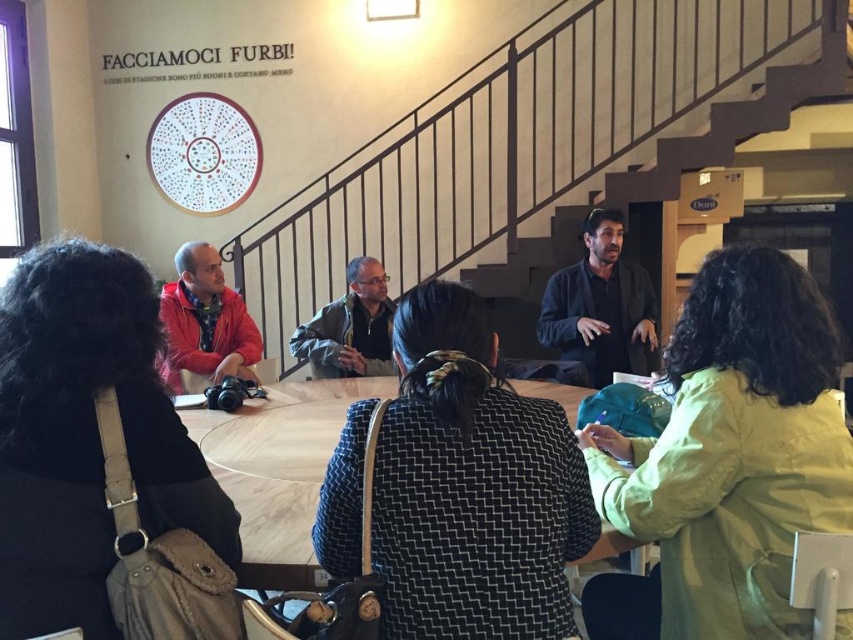
Question: Can you confirm if red jacket at left is positioned to the right of dark blue fabric jacket at center?

Choices:
 (A) yes
 (B) no

Answer: (B)

Question: Which object is closer to the camera taking this photo?

Choices:
 (A) wooden staircase at center
 (B) wooden round table at center

Answer: (B)

Question: Which point is closer to the camera?

Choices:
 (A) (177, 344)
 (B) (262, 516)
 (C) (358, 300)
 (D) (335, 483)

Answer: (D)

Question: Considering the relative positions of green matte jacket at upper right and green fabric jacket at center in the image provided, where is green matte jacket at upper right located with respect to green fabric jacket at center?

Choices:
 (A) right
 (B) left

Answer: (A)

Question: Which point is farther from the camera taking this photo?

Choices:
 (A) (440, 449)
 (B) (514, 259)
 (C) (541, 316)

Answer: (B)

Question: From the image, what is the correct spatial relationship of green matte jacket at upper right in relation to green fabric jacket at center?

Choices:
 (A) right
 (B) left

Answer: (A)